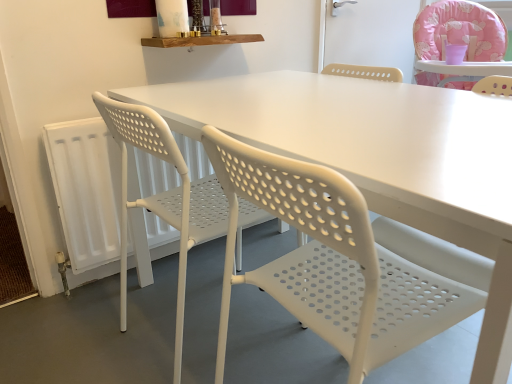
Question: Is pink fabric highchair at upper right, arranged as the 3th chair when viewed from the left, taller than white plastic radiator at lower left?

Choices:
 (A) no
 (B) yes

Answer: (A)

Question: Does pink fabric highchair at upper right, the first chair viewed from the right, contain white plastic radiator at lower left?

Choices:
 (A) no
 (B) yes

Answer: (A)

Question: Is pink fabric highchair at upper right, the first chair viewed from the right, positioned beyond the bounds of white plastic radiator at lower left?

Choices:
 (A) no
 (B) yes

Answer: (B)

Question: Does pink fabric highchair at upper right, arranged as the 3th chair when viewed from the left, turn towards white plastic radiator at lower left?

Choices:
 (A) yes
 (B) no

Answer: (B)

Question: Is the depth of pink fabric highchair at upper right, arranged as the 3th chair when viewed from the left, less than that of white plastic radiator at lower left?

Choices:
 (A) yes
 (B) no

Answer: (B)

Question: From a real-world perspective, is white perforated plastic chair at left, marked as the first chair in a left-to-right arrangement, positioned above or below pink fabric highchair at upper right, the first chair viewed from the right?

Choices:
 (A) above
 (B) below

Answer: (B)

Question: Considering their positions, is white perforated plastic chair at left, the third chair positioned from the right, located in front of or behind pink fabric highchair at upper right, the first chair viewed from the right?

Choices:
 (A) behind
 (B) front

Answer: (B)

Question: Does point (153, 210) appear closer or farther from the camera than point (441, 4)?

Choices:
 (A) farther
 (B) closer

Answer: (B)

Question: Based on their sizes in the image, would you say white perforated plastic chair at left, the third chair positioned from the right, is bigger or smaller than pink fabric highchair at upper right, the first chair viewed from the right?

Choices:
 (A) small
 (B) big

Answer: (A)

Question: Is pink fabric highchair at upper right, the first chair viewed from the right, situated inside white perforated plastic chair at left, marked as the first chair in a left-to-right arrangement, or outside?

Choices:
 (A) inside
 (B) outside

Answer: (B)

Question: In terms of size, does pink fabric highchair at upper right, arranged as the 3th chair when viewed from the left, appear bigger or smaller than white perforated plastic chair at left, marked as the first chair in a left-to-right arrangement?

Choices:
 (A) big
 (B) small

Answer: (A)

Question: Does point (x=442, y=4) appear closer or farther from the camera than point (x=206, y=201)?

Choices:
 (A) farther
 (B) closer

Answer: (A)

Question: From their relative heights in the image, would you say pink fabric highchair at upper right, the first chair viewed from the right, is taller or shorter than white perforated plastic chair at left, the third chair positioned from the right?

Choices:
 (A) tall
 (B) short

Answer: (B)

Question: From a real-world perspective, is white perforated plastic chair at left, the third chair positioned from the right, above or below white plastic radiator at lower left?

Choices:
 (A) above
 (B) below

Answer: (A)

Question: In terms of size, does white perforated plastic chair at left, the third chair positioned from the right, appear bigger or smaller than white plastic radiator at lower left?

Choices:
 (A) big
 (B) small

Answer: (A)